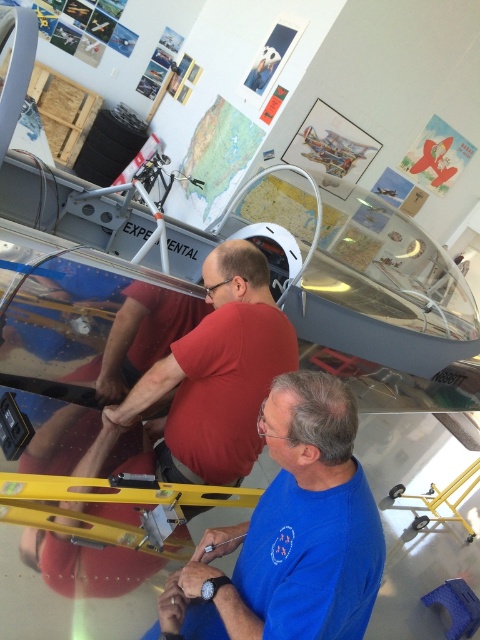
Can you confirm if blue fabric shirt at lower center is positioned below matte red shirt at center?

Indeed, blue fabric shirt at lower center is positioned under matte red shirt at center.

Who is more forward, [278,474] or [191,376]?

Point [278,474] is in front.

Between point (279, 481) and point (230, 419), which one is positioned behind?

The point (230, 419) is more distant.

The width and height of the screenshot is (480, 640). In order to click on blue fabric shirt at lower center in this screenshot , I will do `click(291, 532)`.